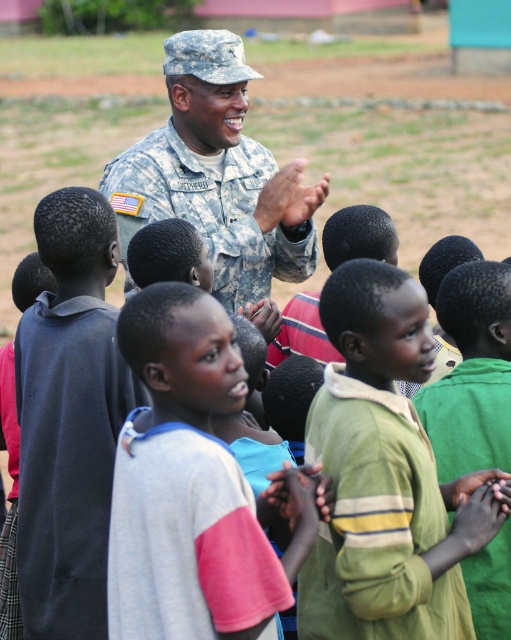
Who is shorter, green cotton shirt at center or camouflage uniform at center?

green cotton shirt at center is shorter.

Does green cotton shirt at center have a smaller size compared to camouflage uniform at center?

Yes, green cotton shirt at center is smaller than camouflage uniform at center.

Is point (377, 355) farther from camera compared to point (250, 77)?

That is False.

Find the location of a particular element. The width and height of the screenshot is (511, 640). green cotton shirt at center is located at coordinates (385, 476).

Who is shorter, gray cotton shirt at center or camouflage uniform at center?

gray cotton shirt at center is shorter.

Looking at this image, who is positioned more to the right, gray cotton shirt at center or camouflage uniform at center?

gray cotton shirt at center

The width and height of the screenshot is (511, 640). I want to click on gray cotton shirt at center, so click(x=190, y=484).

At what (x,y) coordinates should I click in order to perform the action: click on gray cotton shirt at center. Please return your answer as a coordinate pair (x, y). Looking at the image, I should click on (190, 484).

Looking at this image, who is taller, green cotton shirt at center or green textured shirt at center?

green cotton shirt at center is taller.

Does green cotton shirt at center have a lesser width compared to green textured shirt at center?

No.

Which is behind, point (314, 451) or point (478, 269)?

Positioned behind is point (478, 269).

The image size is (511, 640). Find the location of `green cotton shirt at center`. green cotton shirt at center is located at coordinates (385, 476).